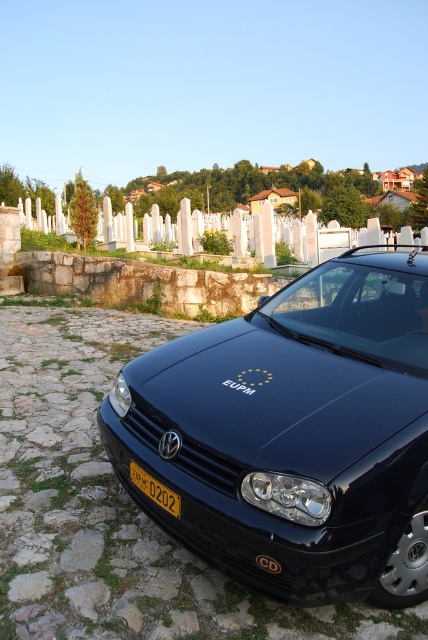
Question: Which point is closer to the camera taking this photo?

Choices:
 (A) (267, 387)
 (B) (149, 480)

Answer: (B)

Question: Can you confirm if glossy black car at center is thinner than yellow matte license plate at center?

Choices:
 (A) yes
 (B) no

Answer: (B)

Question: Which of the following is the farthest from the observer?

Choices:
 (A) (315, 492)
 (B) (133, 481)

Answer: (B)

Question: Which point appears closest to the camera in this image?

Choices:
 (A) (171, 499)
 (B) (265, 570)

Answer: (B)

Question: Does glossy black car at center have a larger size compared to yellow matte license plate at center?

Choices:
 (A) yes
 (B) no

Answer: (A)

Question: Is glossy black car at center smaller than yellow matte license plate at center?

Choices:
 (A) yes
 (B) no

Answer: (B)